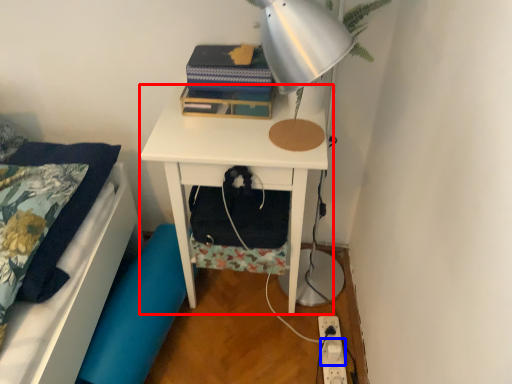
Question: Which of the following is the farthest to the observer, nightstand (highlighted by a red box) or electric outlet (highlighted by a blue box)?

Choices:
 (A) nightstand
 (B) electric outlet

Answer: (B)